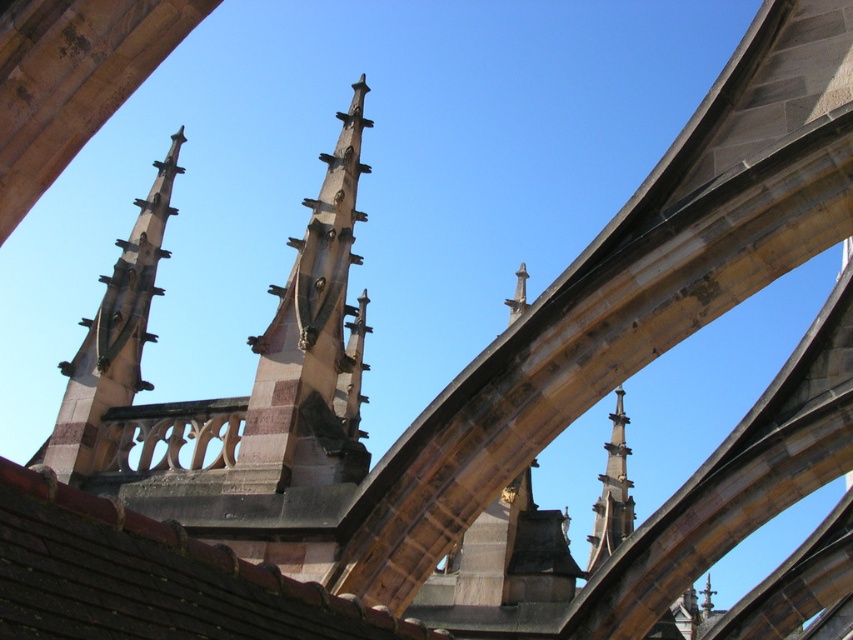
Question: Which point appears closest to the camera in this image?

Choices:
 (A) (608, 506)
 (B) (294, 406)

Answer: (B)

Question: Which of the following is the closest to the observer?

Choices:
 (A) smooth stone spire at center
 (B) brown stone spire at center

Answer: (B)

Question: Does brown stone spire at center have a larger size compared to smooth stone spire at center?

Choices:
 (A) yes
 (B) no

Answer: (A)

Question: Does brown stone spire at center appear on the left side of smooth stone spire at center?

Choices:
 (A) yes
 (B) no

Answer: (A)

Question: Does brown stone spire at center have a larger size compared to smooth stone spire at center?

Choices:
 (A) no
 (B) yes

Answer: (B)